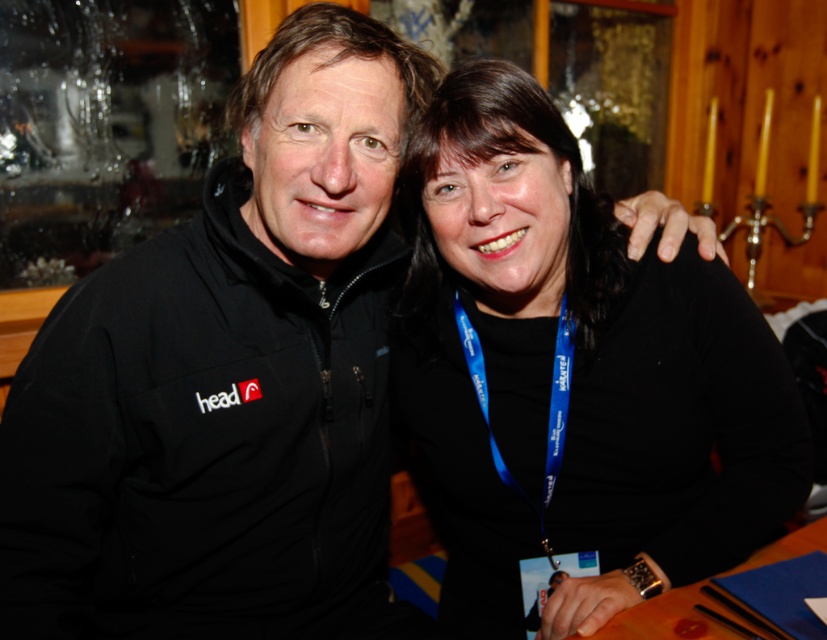
Who is positioned more to the right, wooden table at lower right or blue fabric lanyard at lower center?

Positioned to the right is wooden table at lower right.

Is point (790, 556) more distant than point (460, 307)?

No, (790, 556) is closer to viewer.

Between point (711, 604) and point (464, 353), which one is positioned in front?

Positioned in front is point (711, 604).

Locate an element on the screen. This screenshot has height=640, width=827. wooden table at lower right is located at coordinates (704, 596).

Can you confirm if black matte shirt at center is smaller than blue fabric lanyard at lower center?

Incorrect, black matte shirt at center is not smaller in size than blue fabric lanyard at lower center.

The height and width of the screenshot is (640, 827). What do you see at coordinates (572, 372) in the screenshot? I see `black matte shirt at center` at bounding box center [572, 372].

Is point (662, 541) more distant than point (553, 396)?

No.

Locate an element on the screen. black matte shirt at center is located at coordinates (572, 372).

Locate an element on the screen. The height and width of the screenshot is (640, 827). black matte shirt at center is located at coordinates [x=572, y=372].

Between point (466, 179) and point (655, 636), which one is positioned behind?

The point (466, 179) is behind.

The width and height of the screenshot is (827, 640). Describe the element at coordinates (572, 372) in the screenshot. I see `black matte shirt at center` at that location.

The height and width of the screenshot is (640, 827). I want to click on black matte shirt at center, so point(572,372).